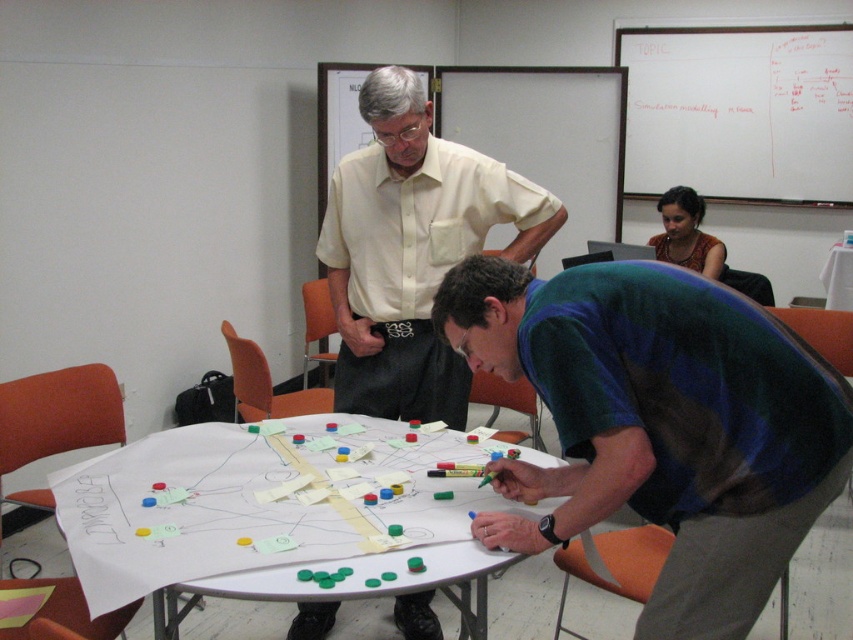
Is white paper at center positioned before brown fabric shirt at upper center?

That is True.

Between white paper at center and brown fabric shirt at upper center, which one appears on the left side from the viewer's perspective?

white paper at center is more to the left.

Is point (328, 536) closer to viewer compared to point (701, 236)?

Yes, it is.

You are a GUI agent. You are given a task and a screenshot of the screen. Output one action in this format:
    pyautogui.click(x=<x>, y=<y>)
    Task: Click on the white paper at center
    The width and height of the screenshot is (853, 640).
    Given the screenshot: What is the action you would take?
    pyautogui.click(x=263, y=515)

Does white paper at center appear under light beige shirt at center?

Indeed, white paper at center is positioned under light beige shirt at center.

Is white paper at center taller than light beige shirt at center?

Incorrect, white paper at center's height is not larger of light beige shirt at center's.

What do you see at coordinates (263, 515) in the screenshot? I see `white paper at center` at bounding box center [263, 515].

Locate an element on the screen. white paper at center is located at coordinates (263, 515).

Does green fabric shirt at center appear over white paper at center?

Yes.

This screenshot has height=640, width=853. What do you see at coordinates (660, 422) in the screenshot? I see `green fabric shirt at center` at bounding box center [660, 422].

Locate an element on the screen. The width and height of the screenshot is (853, 640). green fabric shirt at center is located at coordinates (660, 422).

Locate an element on the screen. green fabric shirt at center is located at coordinates (660, 422).